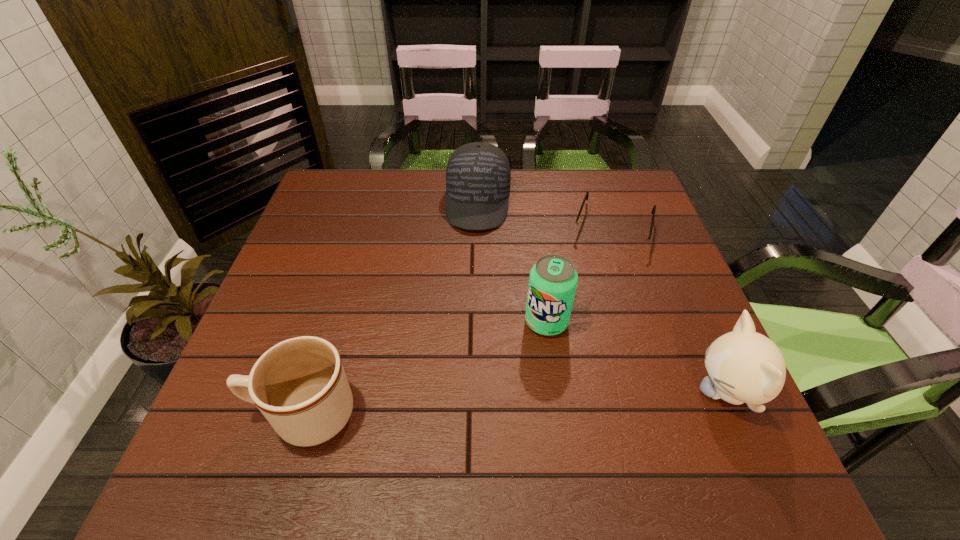
The height and width of the screenshot is (540, 960). I want to click on baseball cap at the far edge, so click(x=478, y=176).

At what (x,y) coordinates should I click in order to perform the action: click on mug that is at the near edge. Please return your answer as a coordinate pair (x, y). The height and width of the screenshot is (540, 960). Looking at the image, I should click on (299, 385).

Where is `kitten that is at the near edge`? The width and height of the screenshot is (960, 540). kitten that is at the near edge is located at coordinates (744, 366).

At what (x,y) coordinates should I click in order to perform the action: click on object positioned at the left edge. Please return your answer as a coordinate pair (x, y). The height and width of the screenshot is (540, 960). Looking at the image, I should click on (299, 385).

Locate an element on the screen. Image resolution: width=960 pixels, height=540 pixels. kitten that is positioned at the right edge is located at coordinates (744, 366).

Identify the location of spectacles that is at the right edge. (630, 242).

Identify the location of object at the near left corner. This screenshot has height=540, width=960. (299, 385).

Image resolution: width=960 pixels, height=540 pixels. I want to click on object located in the far right corner section of the desktop, so click(x=630, y=242).

Find the location of `object located in the near right corner section of the desktop`. object located in the near right corner section of the desktop is located at coordinates (744, 366).

Locate an element on the screen. free space at the far edge of the desktop is located at coordinates (521, 205).